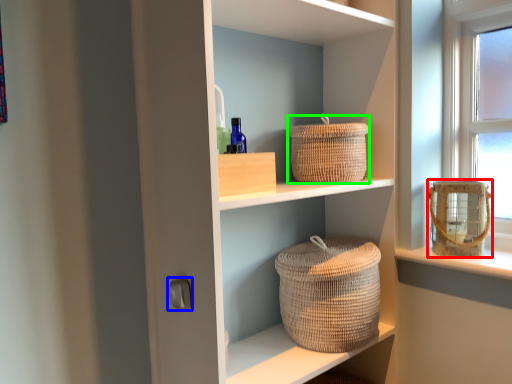
Question: Considering the real-world distances, which object is closest to basket container (highlighted by a red box)? door handle (highlighted by a blue box) or basket (highlighted by a green box).

Choices:
 (A) door handle
 (B) basket

Answer: (B)